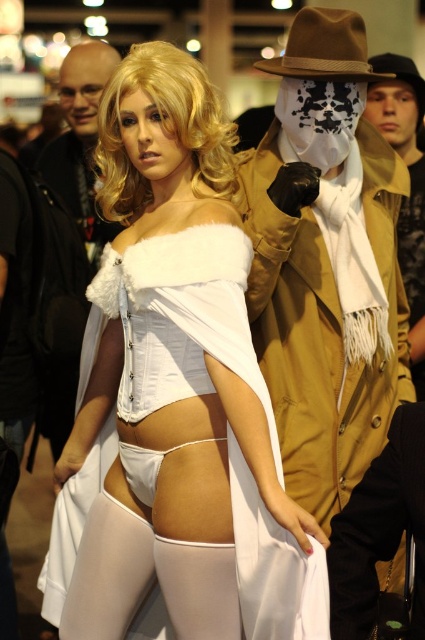
Question: Does white satin dress at center have a greater width compared to tan leather trench coat at center?

Choices:
 (A) no
 (B) yes

Answer: (B)

Question: Can you confirm if white satin dress at center is positioned to the right of tan leather trench coat at center?

Choices:
 (A) yes
 (B) no

Answer: (B)

Question: Is tan leather trench coat at center to the right of brown straw cowboy hat at upper center from the viewer's perspective?

Choices:
 (A) yes
 (B) no

Answer: (A)

Question: Among these objects, which one is nearest to the camera?

Choices:
 (A) tan leather trench coat at center
 (B) tan leather jacket at upper right
 (C) brown straw cowboy hat at upper center
 (D) white satin dress at center

Answer: (D)

Question: Which of the following is the closest to the observer?

Choices:
 (A) (319, 202)
 (B) (121, 141)
 (C) (326, 28)
 (D) (419, 188)

Answer: (B)

Question: Considering the real-world distances, which object is closest to the tan leather trench coat at center?

Choices:
 (A) white satin dress at center
 (B) brown straw cowboy hat at upper center
 (C) tan leather jacket at upper right

Answer: (A)